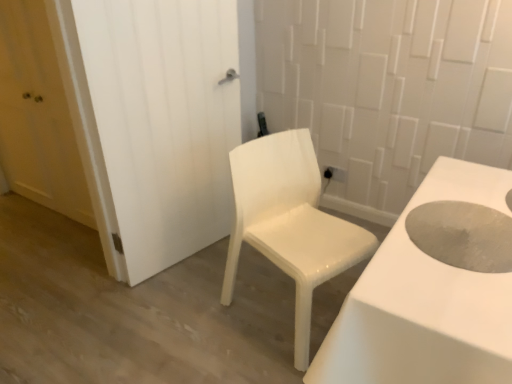
Find the location of `vacant space in white glossy chair at center (from a real-world perspective)`. vacant space in white glossy chair at center (from a real-world perspective) is located at coordinates (282, 309).